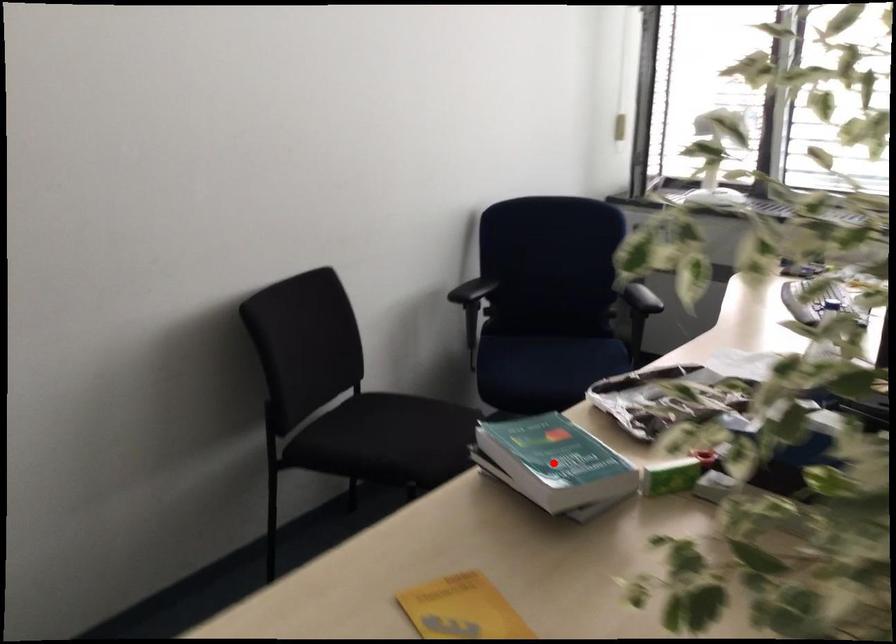
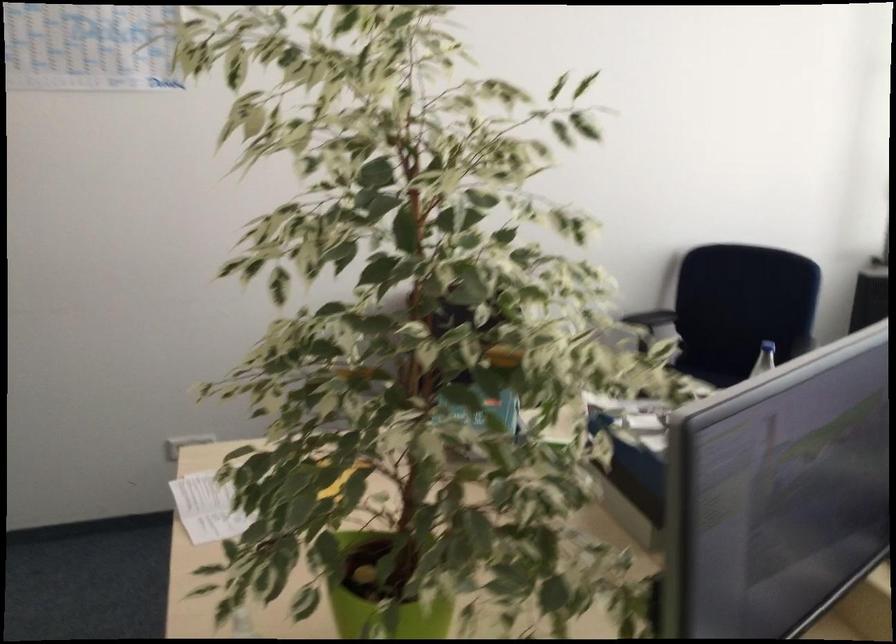
Question: I am providing you with two images of the same scene from different viewpoints. A red point is marked on the first image. Is the red point's position out of view in image 2?

Choices:
 (A) Yes
 (B) No

Answer: (A)